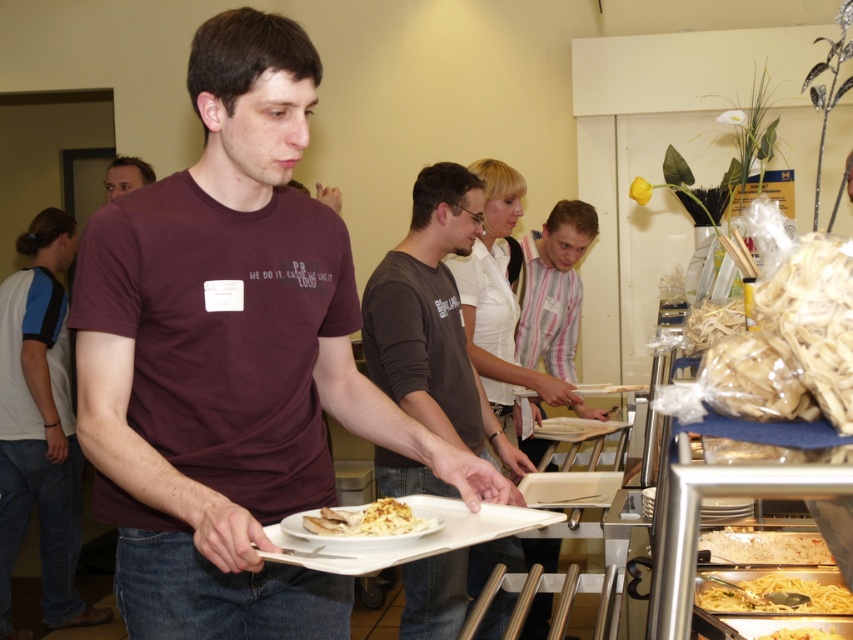
The width and height of the screenshot is (853, 640). What do you see at coordinates (229, 358) in the screenshot?
I see `maroon t-shirt at center` at bounding box center [229, 358].

Consider the image. Is maroon t-shirt at center shorter than yellowish matte spaghetti at lower right?

No.

This screenshot has width=853, height=640. I want to click on maroon t-shirt at center, so click(x=229, y=358).

Which is below, white glossy plate at center or yellowish matte pasta at lower right?

Positioned lower is yellowish matte pasta at lower right.

You are a GUI agent. You are given a task and a screenshot of the screen. Output one action in this format:
    pyautogui.click(x=<x>, y=<y>)
    Task: Click on the white glossy plate at center
    
    Given the screenshot: What is the action you would take?
    tap(368, 520)

This screenshot has width=853, height=640. What do you see at coordinates (432, 317) in the screenshot? I see `brown matte shirt at center` at bounding box center [432, 317].

Does brown matte shirt at center come in front of white glossy plate at center?

No, it is behind white glossy plate at center.

This screenshot has height=640, width=853. I want to click on brown matte shirt at center, so click(432, 317).